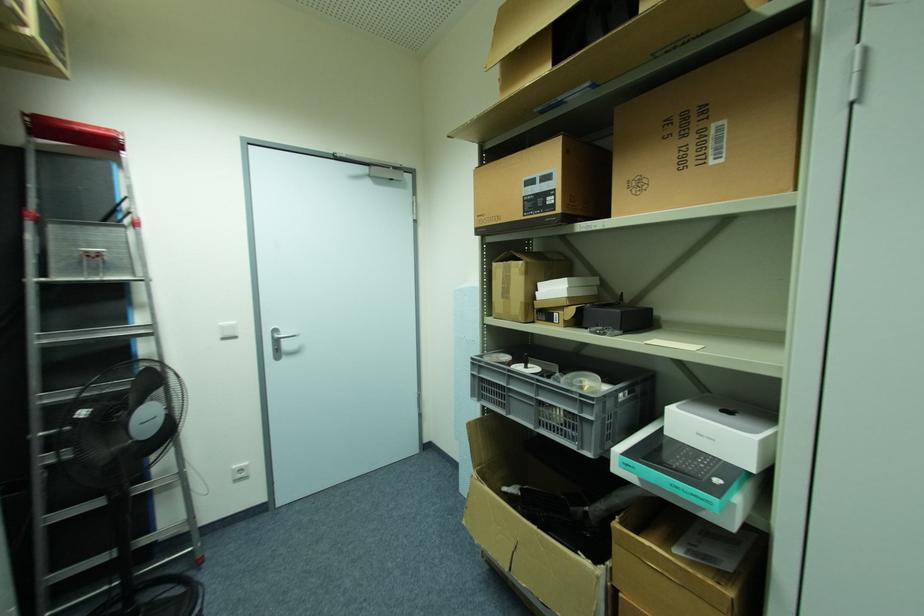
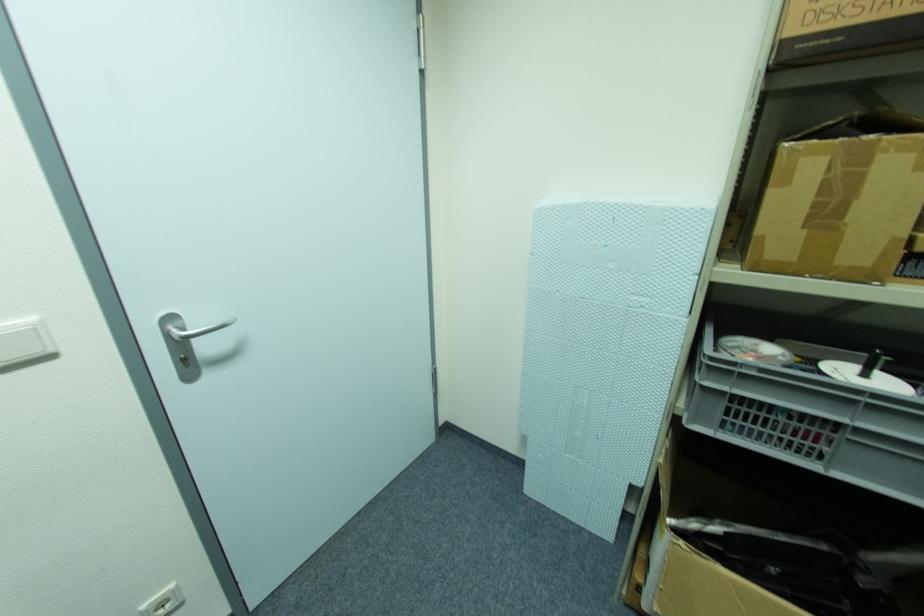
Find the pixel in the second image that matches (511,390) in the first image.

(859, 432)